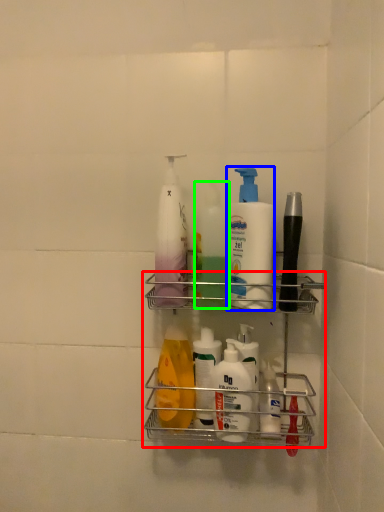
Question: Estimate the real-world distances between objects in this image. Which object is closer to shelf (highlighted by a red box), cleaning product (highlighted by a blue box) or cleaning product (highlighted by a green box)?

Choices:
 (A) cleaning product
 (B) cleaning product

Answer: (A)